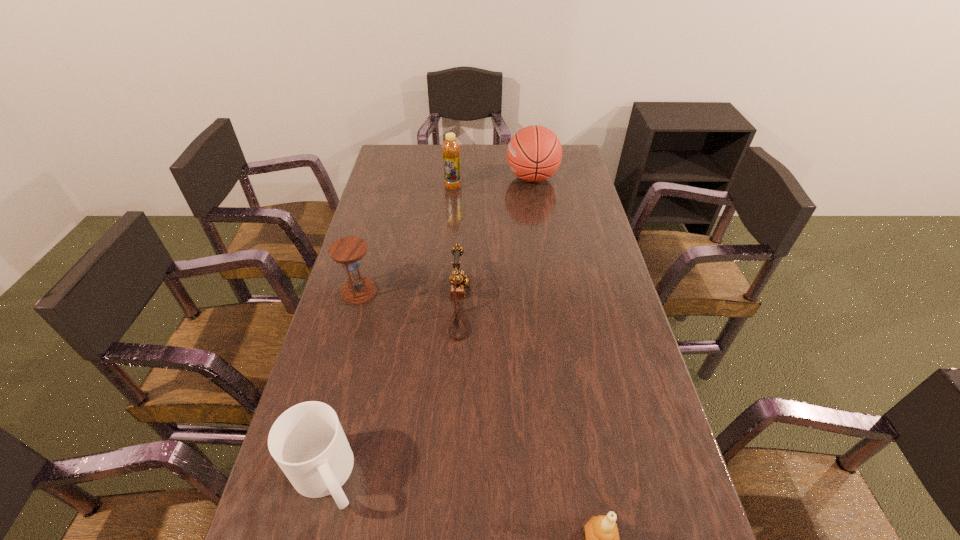
Identify the location of free region located 0.260m on the right of the mug. (486, 476).

The width and height of the screenshot is (960, 540). In order to click on vacant region located 0.120m on the front-facing side of the telephone in this screenshot , I will do `click(512, 303)`.

Find the location of a particular element. This screenshot has width=960, height=540. object that is at the far edge is located at coordinates tap(534, 153).

Identify the location of hourglass that is at the left edge. The width and height of the screenshot is (960, 540). (348, 251).

Image resolution: width=960 pixels, height=540 pixels. I want to click on mug located in the left edge section of the desktop, so click(x=307, y=441).

Locate an element on the screen. object located at the right edge is located at coordinates (534, 153).

I want to click on object positioned at the far right corner, so click(x=534, y=153).

The image size is (960, 540). I want to click on vacant area at the far edge of the desktop, so click(503, 152).

You are a GUI agent. You are given a task and a screenshot of the screen. Output one action in this format:
    pyautogui.click(x=<x>, y=<y>)
    Task: Click on the vacant area at the left edge
    
    Given the screenshot: What is the action you would take?
    pyautogui.click(x=406, y=214)

You are a GUI agent. You are given a task and a screenshot of the screen. Output one action in this format:
    pyautogui.click(x=<x>, y=<y>)
    Task: Click on the free space at the right edge
    
    Given the screenshot: What is the action you would take?
    (559, 174)